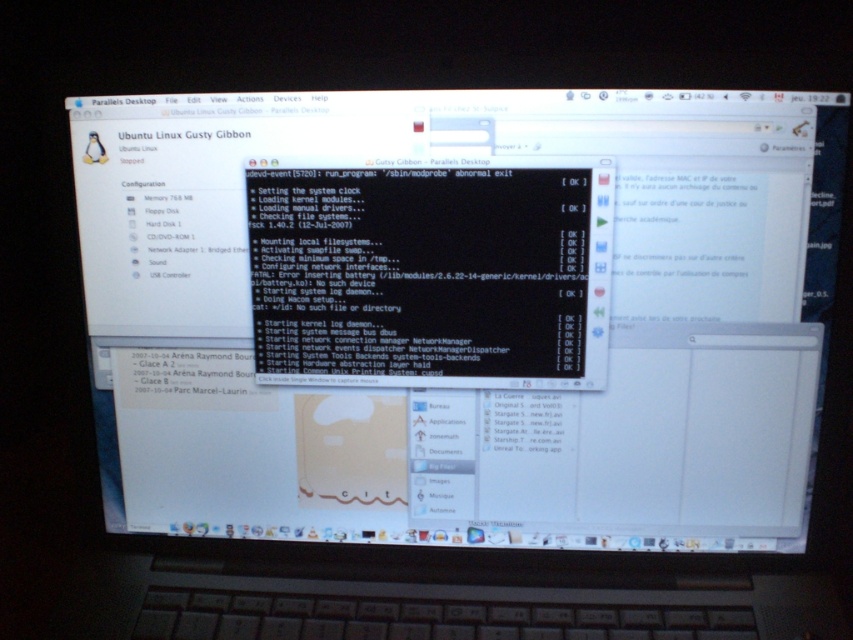
From the picture: You are a system administrator troubleshooting a Linux boot issue. You are sitting 2 feet away from the computer screen. The terminal window showing the boot log is the black glossy terminal at center. Can you comfortably read the text in the terminal without needing to move closer?

The black glossy terminal at center is 29.77 inches from the viewer. Since 29.77 inches is approximately 2.5 feet, which is slightly further than the 2 feet you are currently sitting away, you may need to move closer to comfortably read the text in the terminal.

You are trying to diagnose the boot errors in the terminal. The terminal window is too small to read the error messages clearly. Which object, the black glossy terminal at center or the black glossy text at center, can you resize to make the error messages more legible?

The black glossy terminal at center is much taller than the black glossy text at center, so you can resize the black glossy terminal at center to make the error messages more legible.